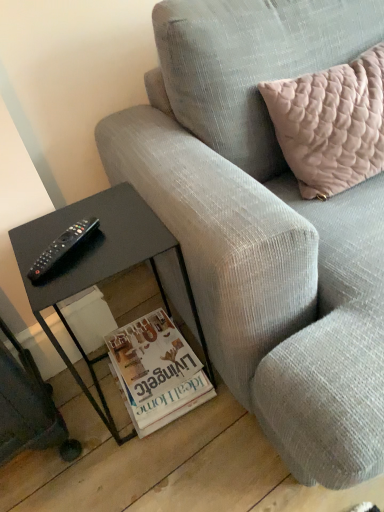
The image size is (384, 512). I want to click on free space on the front side of white glossy magazine at lower center, so click(164, 458).